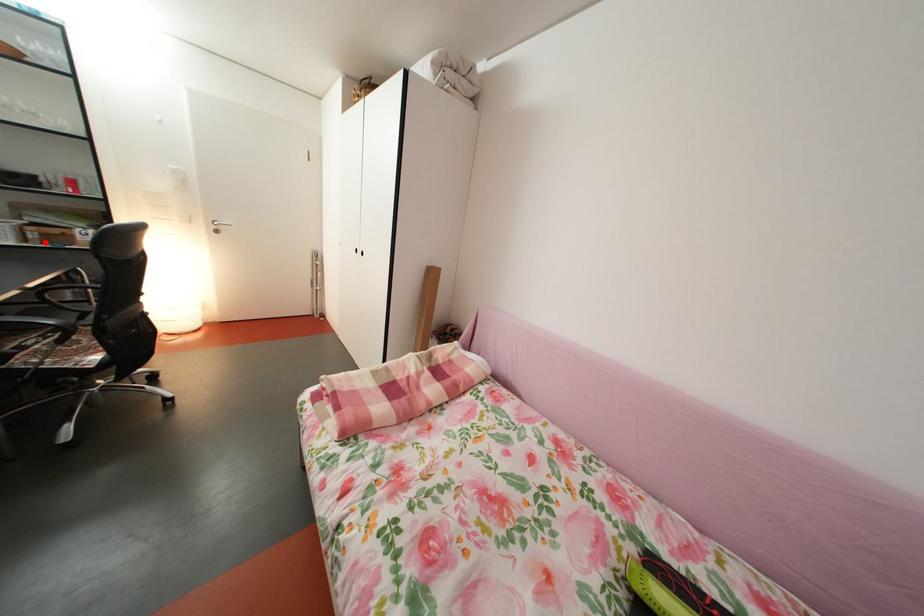
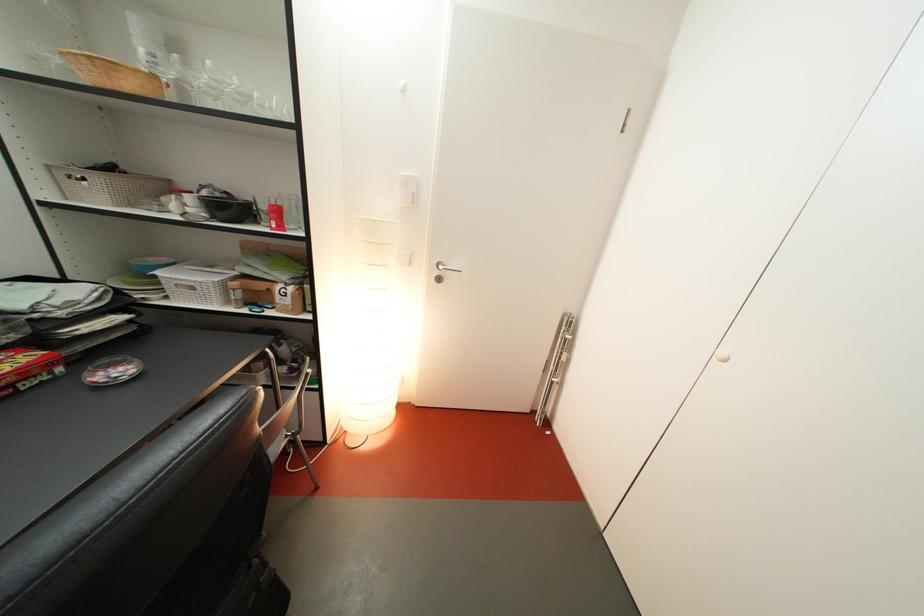
Locate, in the second image, the point that corresponds to the highlighted location in the first image.

(249, 301)